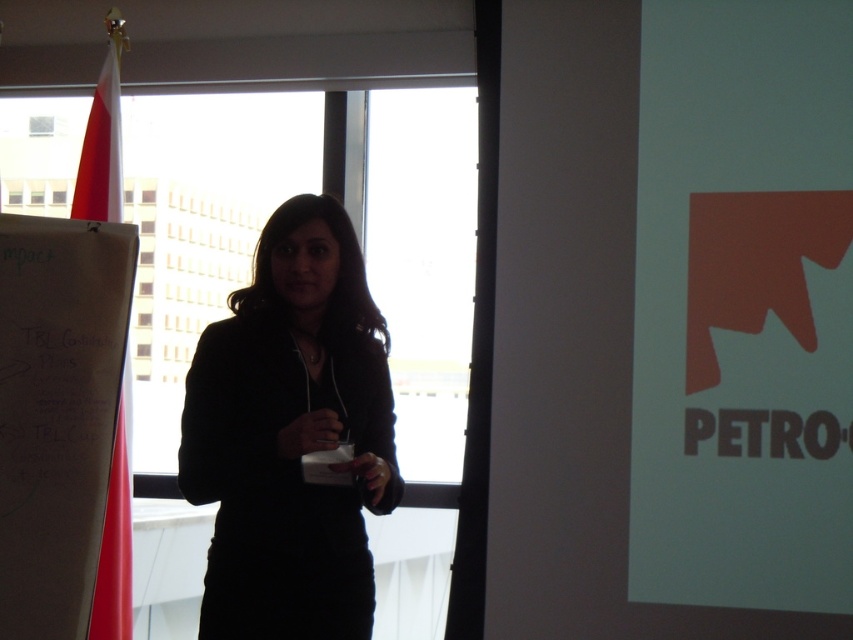
You are organizing a small event and need to decide whether the black matte dress at center will fit into a storage box designed for the red fabric flag at left. Based on their widths, will the dress fit?

The black matte dress at center is wider than the red fabric flag at left, so it may not fit into the storage box designed for the red fabric flag at left.

You are an event organizer and need to decide whether to place a large banner behind the black matte dress at center. Considering the size of the red fabric flag at left, will the banner fit if it is the same size as the flag?

The black matte dress at center is bigger than the red fabric flag at left. If the banner is the same size as the red fabric flag at left, it may not be large enough to effectively cover the area behind the black matte dress at center.